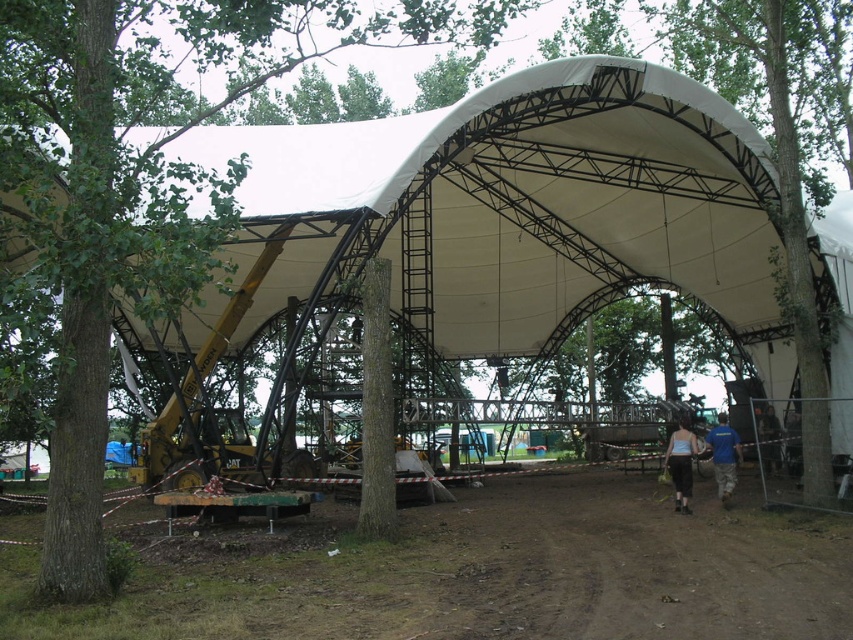
You are a construction worker standing on the brown dirt track at lower center and need to reach the dark blue shirt at lower right. Which direction should you move to get there?

You should move to the right because the dark blue shirt at lower right is to the right of the brown dirt track at lower center.

You are a delivery truck driver arriving at the construction site. You need to drive along the brown dirt track at lower center to reach the white canopy structure. Considering the width of the track, will you be able to safely navigate through it without hitting the green leafy tree at left?

The brown dirt track at lower center is narrower than the green leafy tree at left, so the delivery truck driver should be cautious as the track may not provide enough space to safely navigate around the tree without risking collision.